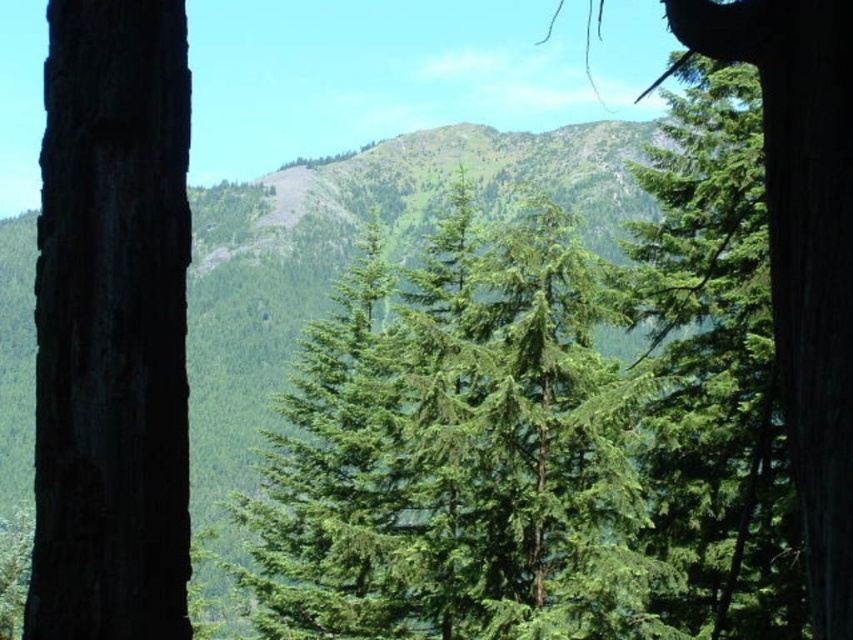
Question: Among these objects, which one is nearest to the camera?

Choices:
 (A) green needle-like tree at center
 (B) dark brown rough bark at left

Answer: (B)

Question: Does green needle-like tree at center have a lesser width compared to dark brown rough bark at left?

Choices:
 (A) yes
 (B) no

Answer: (B)

Question: Which point appears closest to the camera in this image?

Choices:
 (A) (82, 572)
 (B) (624, 394)

Answer: (A)

Question: Is green needle-like tree at center thinner than dark brown rough bark at left?

Choices:
 (A) no
 (B) yes

Answer: (A)

Question: Does green needle-like tree at center lie in front of dark brown rough bark at left?

Choices:
 (A) yes
 (B) no

Answer: (B)